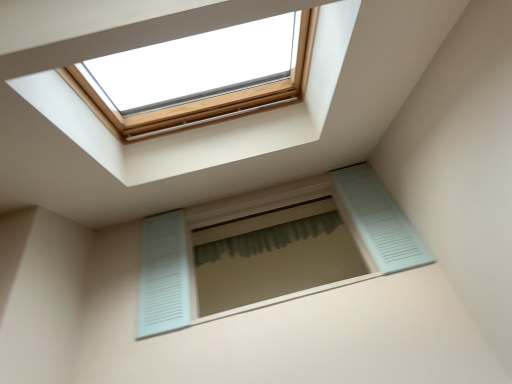
Question: Considering the relative sizes of light blue louvered window at center and green fabric shower curtain at center in the image provided, is light blue louvered window at center wider than green fabric shower curtain at center?

Choices:
 (A) yes
 (B) no

Answer: (A)

Question: From the image's perspective, is light blue louvered window at center on top of green fabric shower curtain at center?

Choices:
 (A) no
 (B) yes

Answer: (A)

Question: From a real-world perspective, is light blue louvered window at center physically below green fabric shower curtain at center?

Choices:
 (A) no
 (B) yes

Answer: (B)

Question: Does light blue louvered window at center lie in front of green fabric shower curtain at center?

Choices:
 (A) no
 (B) yes

Answer: (B)

Question: Is light blue louvered window at center far from green fabric shower curtain at center?

Choices:
 (A) yes
 (B) no

Answer: (B)

Question: From a real-world perspective, is light blue louvered window at center located higher than green fabric shower curtain at center?

Choices:
 (A) no
 (B) yes

Answer: (A)

Question: Does green fabric shower curtain at center have a greater height compared to light blue louvered window at center?

Choices:
 (A) yes
 (B) no

Answer: (B)

Question: Is light blue louvered window at center inside green fabric shower curtain at center?

Choices:
 (A) no
 (B) yes

Answer: (A)

Question: Considering the relative sizes of green fabric shower curtain at center and light blue louvered window at center in the image provided, is green fabric shower curtain at center thinner than light blue louvered window at center?

Choices:
 (A) yes
 (B) no

Answer: (A)

Question: Can we say green fabric shower curtain at center lies outside light blue louvered window at center?

Choices:
 (A) yes
 (B) no

Answer: (A)

Question: Is there a large distance between green fabric shower curtain at center and light blue louvered window at center?

Choices:
 (A) yes
 (B) no

Answer: (B)

Question: Is green fabric shower curtain at center shorter than light blue louvered window at center?

Choices:
 (A) no
 (B) yes

Answer: (B)

Question: Considering their positions, is light blue louvered window at center located in front of or behind green fabric shower curtain at center?

Choices:
 (A) front
 (B) behind

Answer: (A)